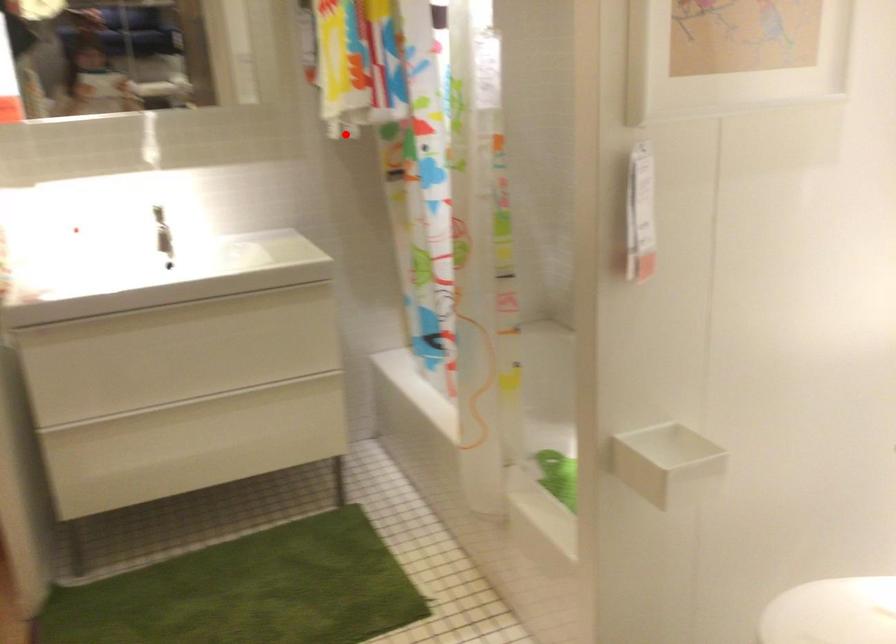
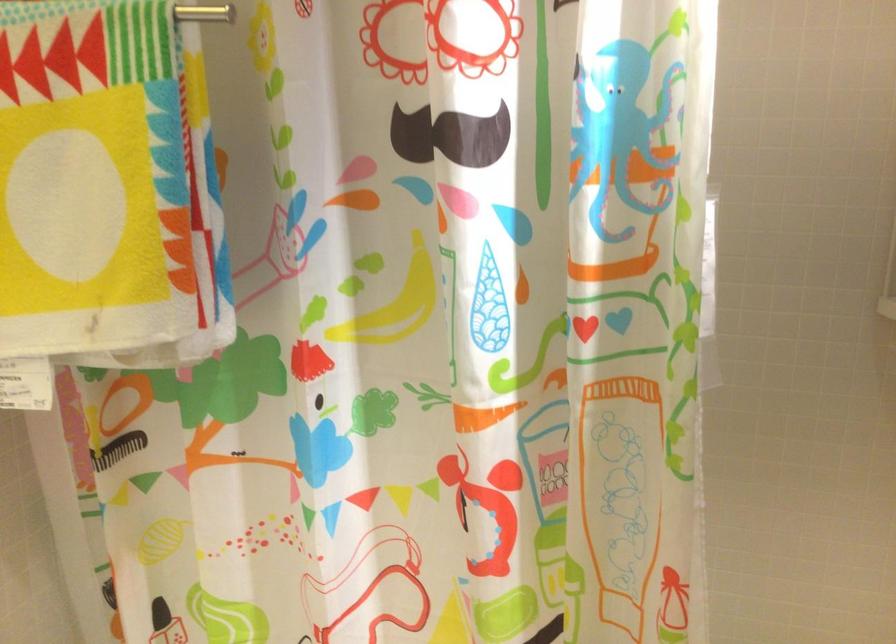
Question: I am providing you with two images of the same scene from different viewpoints. Image1 has a red point marked. In image2, the corresponding 3D location appears at what relative position? Reply with the corresponding letter.

Choices:
 (A) Closer
 (B) Farther

Answer: (A)